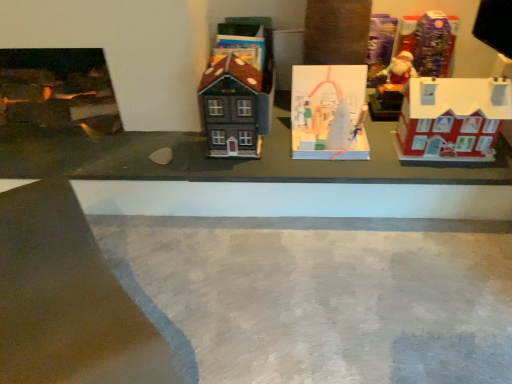
The width and height of the screenshot is (512, 384). Identify the location of free location above gray concrete at center (from a real-world perspective). (295, 291).